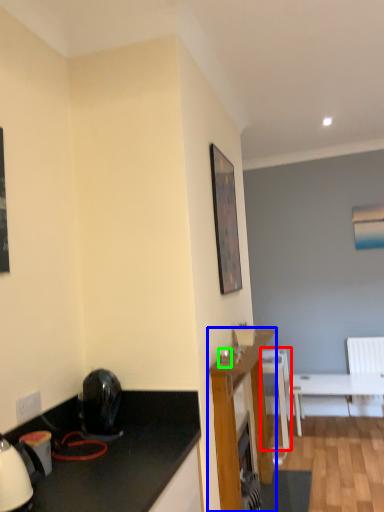
Question: Which is farther away from chair (highlighted by a red box)? cabinetry (highlighted by a blue box) or coffee cup (highlighted by a green box)?

Choices:
 (A) cabinetry
 (B) coffee cup

Answer: (B)